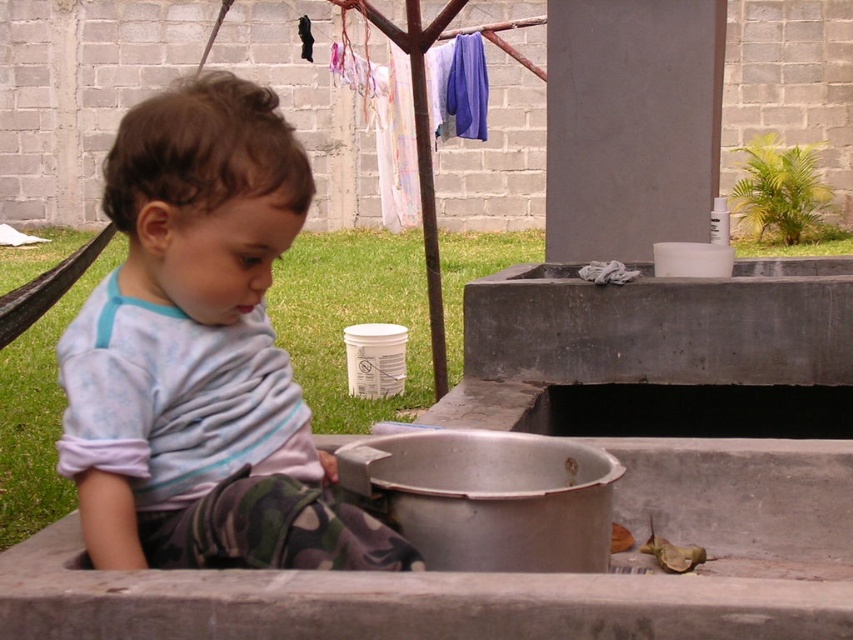
Question: Considering the relative positions of light blue cotton shirt at center and silver metallic basin at lower center in the image provided, where is light blue cotton shirt at center located with respect to silver metallic basin at lower center?

Choices:
 (A) below
 (B) above

Answer: (B)

Question: Observing the image, what is the correct spatial positioning of light blue cotton shirt at center in reference to silver metallic basin at lower center?

Choices:
 (A) right
 (B) left

Answer: (B)

Question: Is light blue cotton shirt at center above silver metallic basin at lower center?

Choices:
 (A) no
 (B) yes

Answer: (B)

Question: Which of the following is the closest to the observer?

Choices:
 (A) silver metallic basin at lower center
 (B) light blue cotton shirt at center

Answer: (B)

Question: Among these objects, which one is nearest to the camera?

Choices:
 (A) light blue cotton shirt at center
 (B) silver metallic basin at lower center

Answer: (A)

Question: Among these points, which one is farthest from the camera?

Choices:
 (A) (152, 225)
 (B) (581, 508)

Answer: (B)